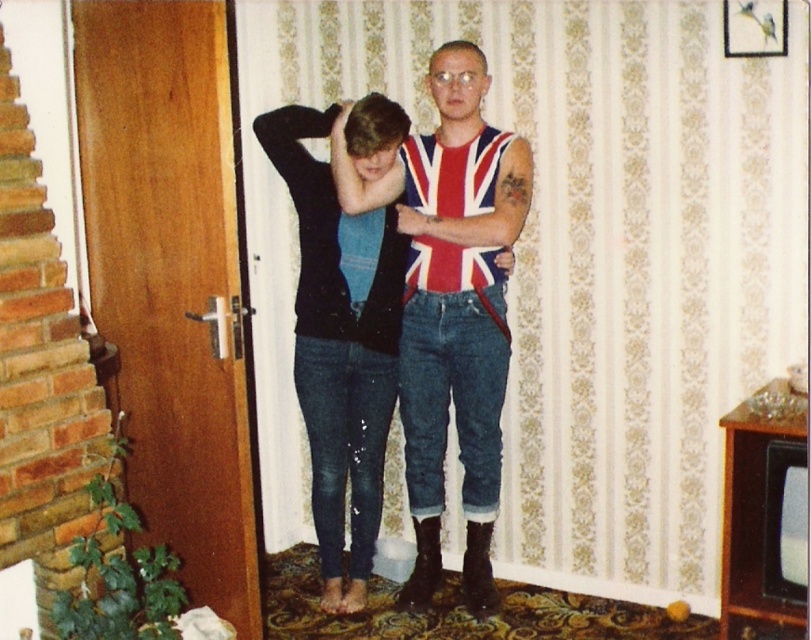
You are standing in the room shown in the image. You need to reach a specific point marked as point (275, 154). Considering the two people in the image, which one is closer to this point?

The point (275, 154) is 9.59 feet from the camera. Since the distance from the camera to the point is given, but no information about the people is provided, it is impossible to determine which person is closer to the point based on the provided information.

You are a fashion designer observing the two individuals in the image. You need to determine which clothing item, the union jack fabric tank top at center or the denim jeans at center, requires more fabric to produce. Based on their sizes, which one would need more material?

The union jack fabric tank top at center is smaller than the denim jeans at center, so the denim jeans at center would require more fabric to produce.

You are a photographer standing in the room and want to take a photo of both the union jack fabric tank top at center and the wooden door with silver handle. The camera you are using has a maximum focus range of 3 meters. Can you capture both subjects in focus without moving the camera?

The distance between the union jack fabric tank top at center and the wooden door with silver handle is 2.86 meters, which is within the camera maximum focus range of 3 meters. Therefore, you can capture both subjects in focus without moving the camera.